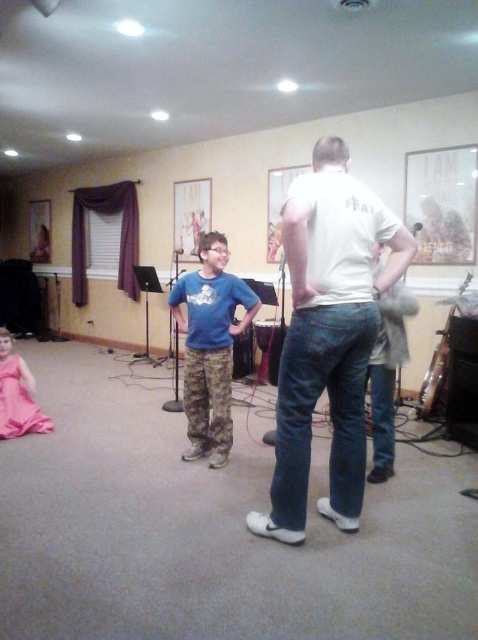
Question: Is blue camouflage pants at center behind pink satin dress at lower left?

Choices:
 (A) no
 (B) yes

Answer: (A)

Question: Which object appears farthest from the camera in this image?

Choices:
 (A) white matte t-shirt at center
 (B) blue camouflage pants at center
 (C) pink satin dress at lower left

Answer: (C)

Question: Is white matte t-shirt at center positioned before blue camouflage pants at center?

Choices:
 (A) yes
 (B) no

Answer: (A)

Question: Which object is positioned closest to the pink satin dress at lower left?

Choices:
 (A) blue camouflage pants at center
 (B) white matte t-shirt at center

Answer: (A)

Question: Among these objects, which one is nearest to the camera?

Choices:
 (A) white matte t-shirt at center
 (B) pink satin dress at lower left

Answer: (A)

Question: Does white matte t-shirt at center have a smaller size compared to pink satin dress at lower left?

Choices:
 (A) yes
 (B) no

Answer: (B)